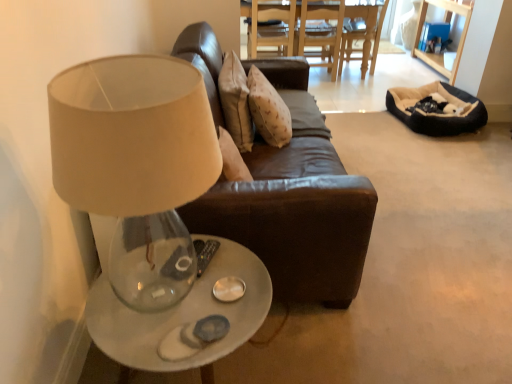
Question: Can brown leather chair at upper center be found inside beige plush bean bag at right?

Choices:
 (A) yes
 (B) no

Answer: (B)

Question: Is beige plush bean bag at right bigger than brown leather chair at upper center?

Choices:
 (A) no
 (B) yes

Answer: (A)

Question: Considering the relative positions of beige plush bean bag at right and brown leather chair at upper center in the image provided, is beige plush bean bag at right in front of brown leather chair at upper center?

Choices:
 (A) no
 (B) yes

Answer: (B)

Question: Is beige plush bean bag at right far away from brown leather chair at upper center?

Choices:
 (A) no
 (B) yes

Answer: (B)

Question: Considering the relative sizes of beige plush bean bag at right and brown leather chair at upper center in the image provided, is beige plush bean bag at right thinner than brown leather chair at upper center?

Choices:
 (A) no
 (B) yes

Answer: (A)

Question: Is point (247, 134) positioned closer to the camera than point (258, 9)?

Choices:
 (A) farther
 (B) closer

Answer: (B)

Question: From the image's perspective, is beige fabric pillow at center above or below brown leather chair at upper center?

Choices:
 (A) below
 (B) above

Answer: (A)

Question: In the image, is beige fabric pillow at center positioned in front of or behind brown leather chair at upper center?

Choices:
 (A) front
 (B) behind

Answer: (A)

Question: Is beige fabric pillow at center wider or thinner than brown leather chair at upper center?

Choices:
 (A) thin
 (B) wide

Answer: (A)

Question: Is translucent glass table at lower left, positioned as the first table in front-to-back order, wider or thinner than beige fabric lampshade at upper left?

Choices:
 (A) thin
 (B) wide

Answer: (B)

Question: Is point (211, 299) closer or farther from the camera than point (180, 251)?

Choices:
 (A) farther
 (B) closer

Answer: (B)

Question: Is translucent glass table at lower left, which ranks as the 1th table in left-to-right order, taller or shorter than beige fabric lampshade at upper left?

Choices:
 (A) tall
 (B) short

Answer: (B)

Question: From the image's perspective, relative to beige fabric lampshade at upper left, is translucent glass table at lower left, which is the second table in top-to-bottom order, above or below?

Choices:
 (A) above
 (B) below

Answer: (B)

Question: From the image's perspective, is translucent glass table at lower left, which is counted as the second table, starting from the right, positioned above or below wooden dining table at center, placed as the second table when sorted from left to right?

Choices:
 (A) above
 (B) below

Answer: (B)

Question: From a real-world perspective, is translucent glass table at lower left, which is the second table in top-to-bottom order, positioned above or below wooden dining table at center, which is the 2th table in front-to-back order?

Choices:
 (A) above
 (B) below

Answer: (B)